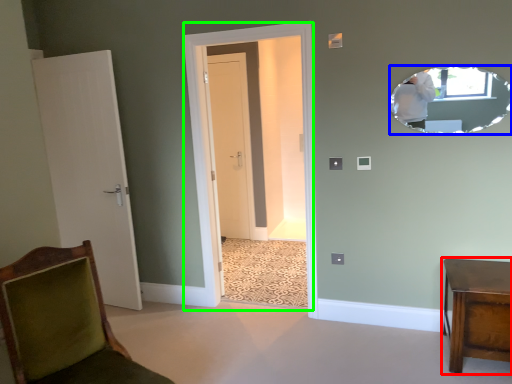
Question: Which object is positioned closest to furniture (highlighted by a red box)? Select from mirror (highlighted by a blue box) and glass door (highlighted by a green box).

Choices:
 (A) mirror
 (B) glass door

Answer: (A)